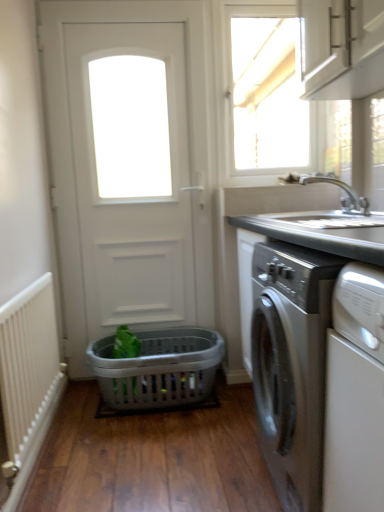
Question: Does silver metallic faucet at upper right have a greater width compared to satin silver washing machine at right?

Choices:
 (A) yes
 (B) no

Answer: (B)

Question: Does silver metallic faucet at upper right touch satin silver washing machine at right?

Choices:
 (A) no
 (B) yes

Answer: (A)

Question: From the image's perspective, is silver metallic faucet at upper right beneath satin silver washing machine at right?

Choices:
 (A) yes
 (B) no

Answer: (B)

Question: Is silver metallic faucet at upper right oriented away from satin silver washing machine at right?

Choices:
 (A) yes
 (B) no

Answer: (B)

Question: Is silver metallic faucet at upper right positioned behind satin silver washing machine at right?

Choices:
 (A) no
 (B) yes

Answer: (B)

Question: Which is correct: white textured radiator at left is inside white glossy window at upper center, or outside of it?

Choices:
 (A) outside
 (B) inside

Answer: (A)

Question: From the image's perspective, is white textured radiator at left above or below white glossy window at upper center?

Choices:
 (A) above
 (B) below

Answer: (B)

Question: Is point (9, 307) closer or farther from the camera than point (243, 164)?

Choices:
 (A) farther
 (B) closer

Answer: (B)

Question: In the image, is white textured radiator at left positioned in front of or behind white glossy window at upper center?

Choices:
 (A) behind
 (B) front

Answer: (B)

Question: Considering the relative positions of silver metallic faucet at upper right and white textured radiator at left in the image provided, is silver metallic faucet at upper right to the left or to the right of white textured radiator at left?

Choices:
 (A) left
 (B) right

Answer: (B)

Question: Is silver metallic faucet at upper right bigger or smaller than white textured radiator at left?

Choices:
 (A) big
 (B) small

Answer: (B)

Question: In terms of height, does silver metallic faucet at upper right look taller or shorter compared to white textured radiator at left?

Choices:
 (A) short
 (B) tall

Answer: (A)

Question: From a real-world perspective, is silver metallic faucet at upper right physically located above or below white textured radiator at left?

Choices:
 (A) above
 (B) below

Answer: (A)

Question: Is gray plastic laundry basket at center situated inside silver metallic faucet at upper right or outside?

Choices:
 (A) outside
 (B) inside

Answer: (A)

Question: From a real-world perspective, is gray plastic laundry basket at center above or below silver metallic faucet at upper right?

Choices:
 (A) above
 (B) below

Answer: (B)